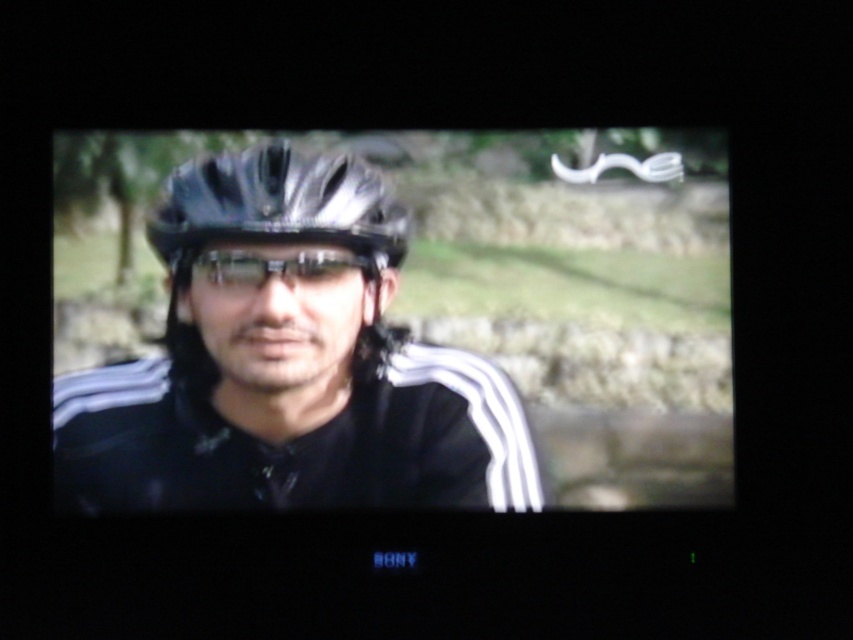
You are watching a cycling event on TV and notice two points on the screen. The first point is at coordinates point (x=364, y=396) and the second is at point (x=277, y=252). Which point is closer to the camera?

Point (x=277, y=252) is closer to the camera than point (x=364, y=396) because the description states that point (x=364, y=396) is further to the camera than point (x=277, y=252).